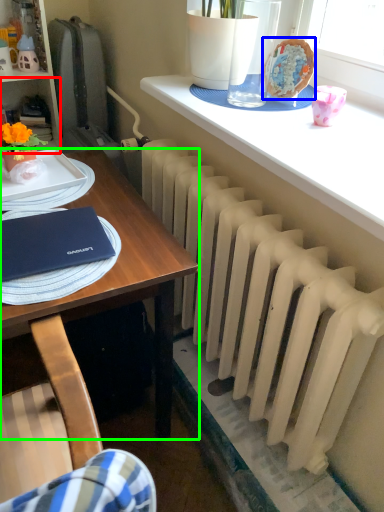
Question: Which object is the closest to the shelf (highlighted by a red box)? Choose among these: floral arrangement (highlighted by a blue box) or desk (highlighted by a green box).

Choices:
 (A) floral arrangement
 (B) desk

Answer: (B)